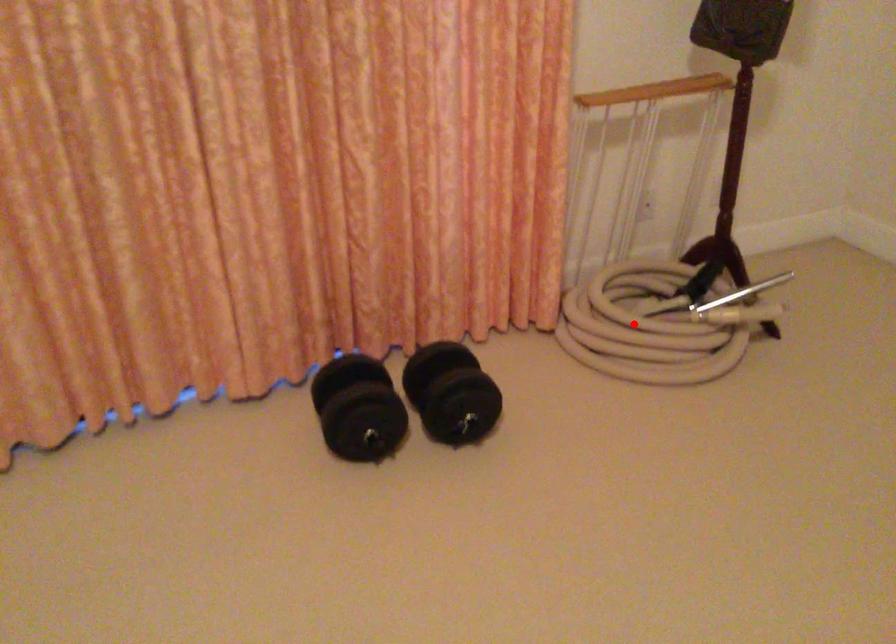
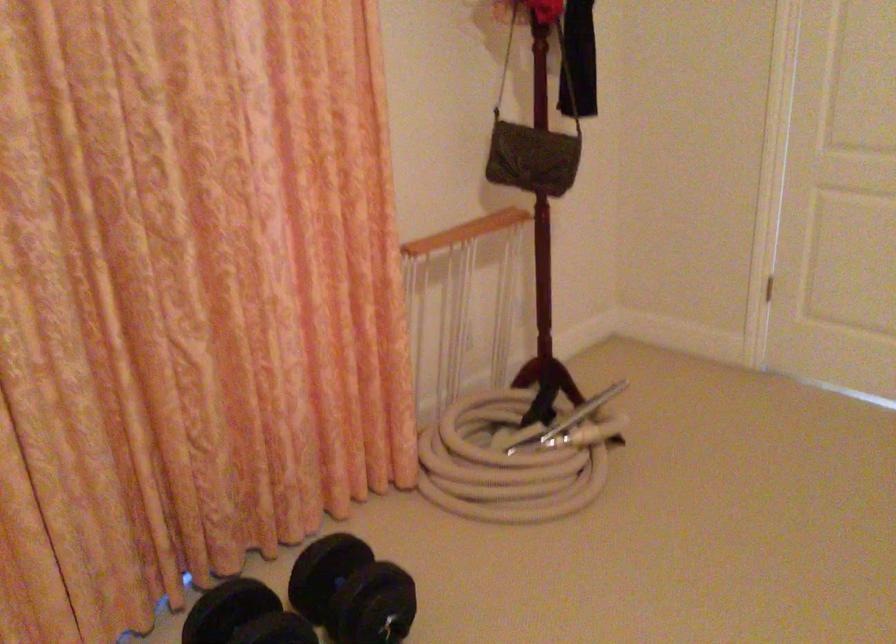
Where in the second image is the point corresponding to the highlighted location from the first image?

(503, 466)